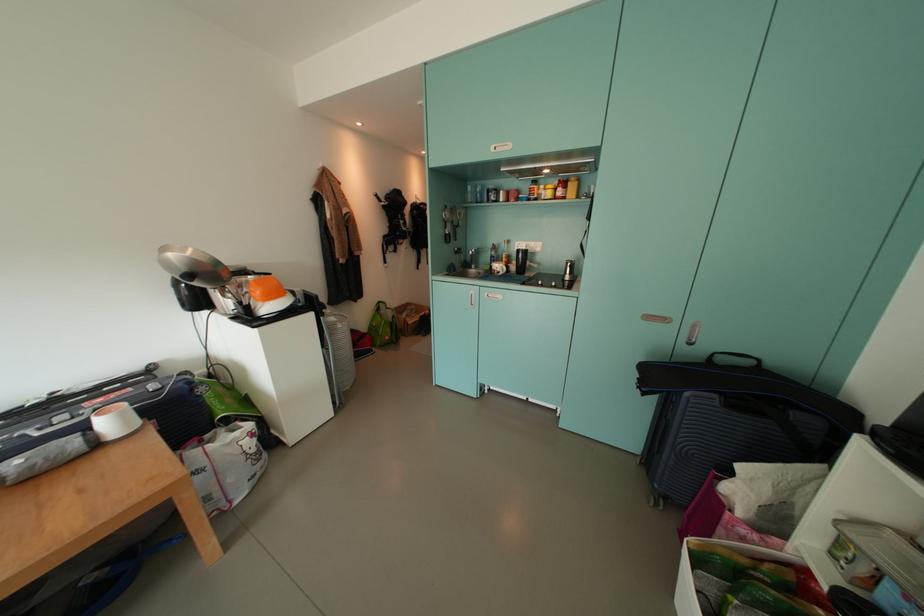
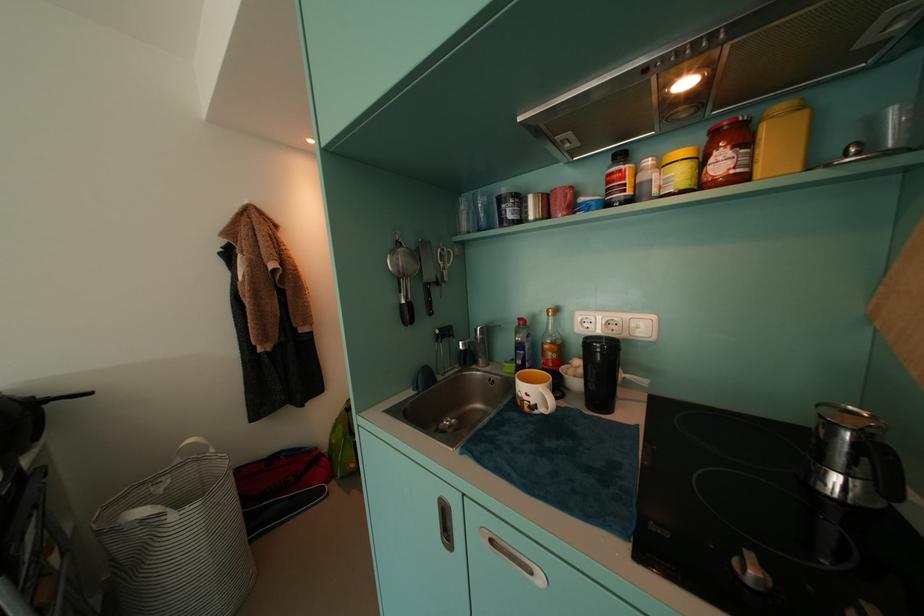
In the second image, find the point that corresponds to pixel 508 276 in the first image.

(550, 413)